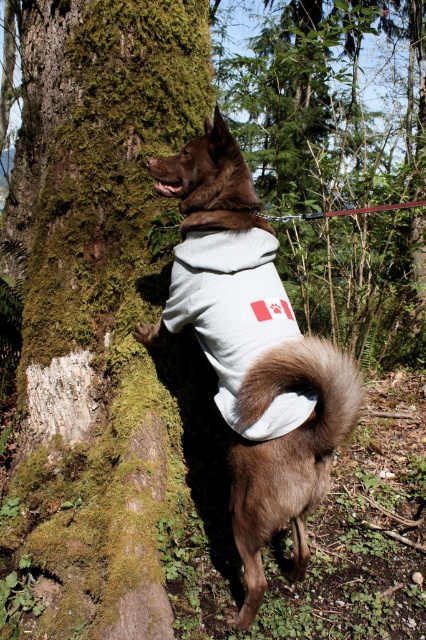
Question: Does green mossy bark at left have a smaller size compared to brown fur coat at center?

Choices:
 (A) no
 (B) yes

Answer: (A)

Question: Where is green mossy bark at left located in relation to brown fur coat at center in the image?

Choices:
 (A) above
 (B) below

Answer: (A)

Question: Which object is closer to the camera taking this photo?

Choices:
 (A) green mossy bark at left
 (B) brown fur coat at center

Answer: (B)

Question: From the image, what is the correct spatial relationship of green mossy bark at left in relation to brown fur coat at center?

Choices:
 (A) right
 (B) left

Answer: (B)